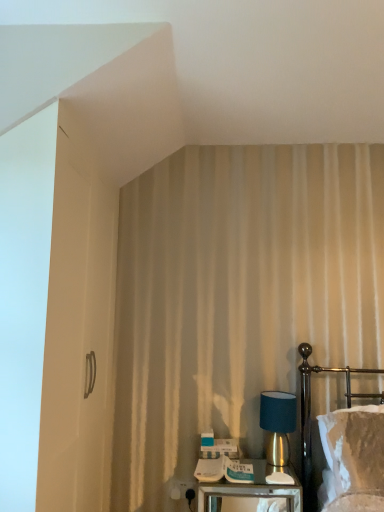
Question: Is point (273, 411) closer or farther from the camera than point (188, 486)?

Choices:
 (A) closer
 (B) farther

Answer: (A)

Question: In terms of width, does teal fabric lampshade at right look wider or thinner when compared to white plastic electric outlet at lower center?

Choices:
 (A) thin
 (B) wide

Answer: (B)

Question: Based on their relative distances, which object is farther from the teal fabric lampshade at right?

Choices:
 (A) velvet white bed at right
 (B) metallic silver nightstand at lower center
 (C) white plastic electric outlet at lower center

Answer: (C)

Question: Considering the real-world distances, which object is farthest from the teal fabric lampshade at right?

Choices:
 (A) velvet white bed at right
 (B) metallic silver nightstand at lower center
 (C) white plastic electric outlet at lower center

Answer: (C)